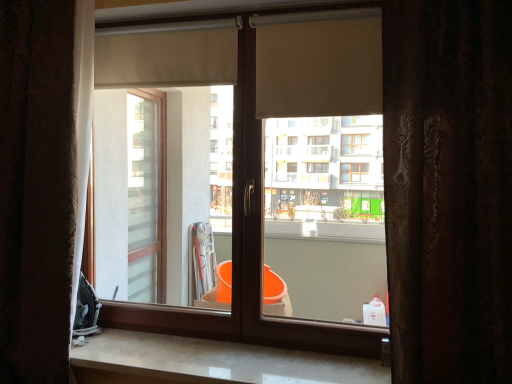
This screenshot has width=512, height=384. What are the coordinates of `empty space that is ontop of beige fabric roller at upper center, the 1th shutter when ordered from front to back (from a real-world perspective)` in the screenshot? It's located at (316, 19).